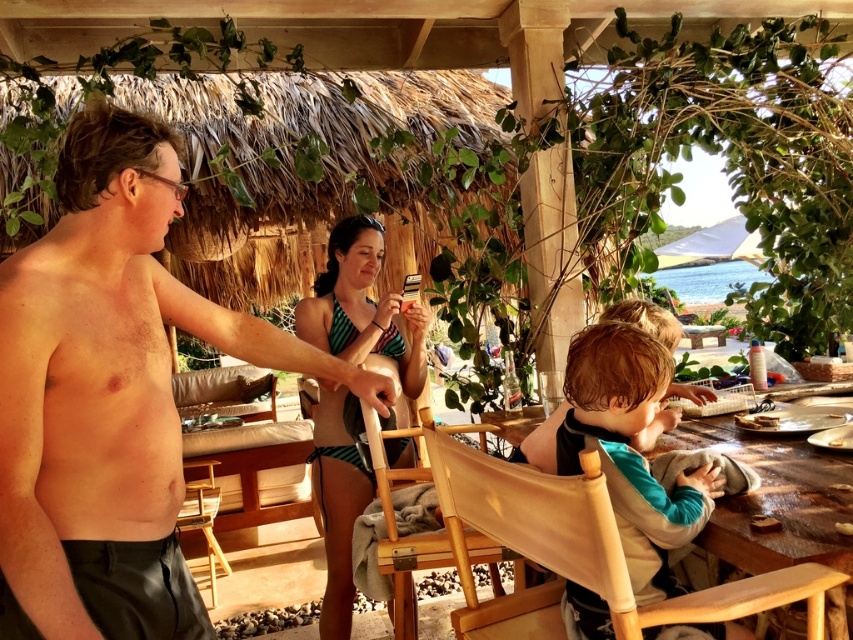
Does shiny skin man at left appear under wooden chair at center?

Actually, shiny skin man at left is above wooden chair at center.

Does shiny skin man at left come in front of wooden chair at center?

Yes, it is in front of wooden chair at center.

What are the coordinates of `shiny skin man at left` in the screenshot? It's located at (109, 396).

Is green striped swimsuit at center smaller than wooden table at lower right?

No, green striped swimsuit at center is not smaller than wooden table at lower right.

Measure the distance between green striped swimsuit at center and camera.

They are 2.22 meters apart.

Between point (317, 323) and point (786, 547), which one is positioned behind?

The point (317, 323) is more distant.

Identify the location of green striped swimsuit at center. This screenshot has height=640, width=853. (363, 308).

How distant is green striped swimsuit at center from wooden chair at center?

They are 13.33 inches apart.

Is point (389, 333) positioned in front of point (430, 424)?

No, (389, 333) is further to viewer.

Locate an element on the screen. This screenshot has height=640, width=853. green striped swimsuit at center is located at coordinates (363, 308).